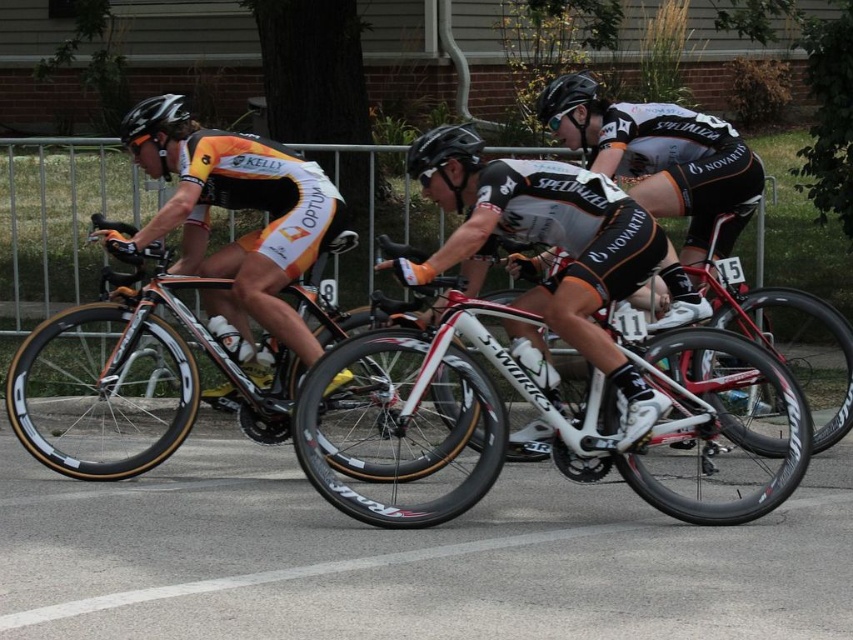
Between white glossy bicycle at center and black matte bicycle helmet at center, which one is positioned lower?

white glossy bicycle at center is below.

Can you confirm if white glossy bicycle at center is positioned below black matte bicycle helmet at center?

Yes, white glossy bicycle at center is below black matte bicycle helmet at center.

Who is more forward, (790, 397) or (578, 84)?

Point (790, 397)

This screenshot has height=640, width=853. What are the coordinates of `white glossy bicycle at center` in the screenshot? It's located at (540, 413).

Between orange/white jersey at left and black/white jersey at center, which one appears on the left side from the viewer's perspective?

orange/white jersey at left is more to the left.

Is orange/white jersey at left shorter than black/white jersey at center?

No, orange/white jersey at left is not shorter than black/white jersey at center.

Between point (189, 156) and point (675, 202), which one is positioned in front?

Point (189, 156)

You are a GUI agent. You are given a task and a screenshot of the screen. Output one action in this format:
    pyautogui.click(x=<x>, y=<y>)
    Task: Click on the orange/white jersey at left
    The height and width of the screenshot is (640, 853).
    Given the screenshot: What is the action you would take?
    pyautogui.click(x=235, y=209)

Can you confirm if black/white jersey at center is bigger than black matte helmet at upper left?

Actually, black/white jersey at center might be smaller than black matte helmet at upper left.

Is point (763, 184) positioned before point (161, 109)?

No, it is not.

Is point (662, 148) closer to camera compared to point (184, 116)?

No, (662, 148) is behind (184, 116).

At what (x,y) coordinates should I click in order to perform the action: click on black/white jersey at center. Please return your answer as a coordinate pair (x, y). This screenshot has height=640, width=853. Looking at the image, I should click on (656, 154).